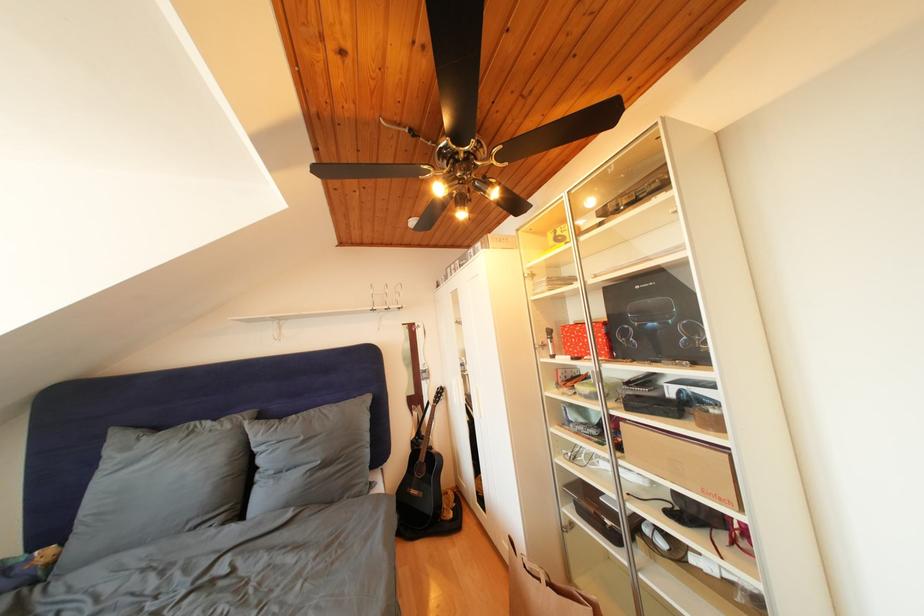
Find where to lift the black acoustic guitar. Please return your answer as a coordinate pair (x, y).

(420, 477)